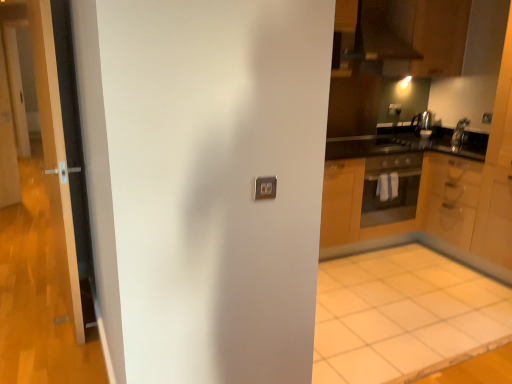
Question: Is wooden cabinet at right, which ranks as the first cabinetry in right-to-left order, at the right side of white tile floor at lower right?

Choices:
 (A) no
 (B) yes

Answer: (B)

Question: From a real-world perspective, is wooden cabinet at right, which ranks as the first cabinetry in right-to-left order, on white tile floor at lower right?

Choices:
 (A) yes
 (B) no

Answer: (A)

Question: Does wooden cabinet at right, placed as the second cabinetry when sorted from left to right, have a smaller size compared to white tile floor at lower right?

Choices:
 (A) no
 (B) yes

Answer: (A)

Question: From the image's perspective, is wooden cabinet at right, which ranks as the first cabinetry in right-to-left order, located beneath white tile floor at lower right?

Choices:
 (A) no
 (B) yes

Answer: (A)

Question: From the image's perspective, is wooden cabinet at right, which ranks as the first cabinetry in right-to-left order, located above white tile floor at lower right?

Choices:
 (A) no
 (B) yes

Answer: (B)

Question: From a real-world perspective, is satin silver kettle at upper right, which is counted as the second appliance, starting from the left, positioned above or below white tile floor at lower right?

Choices:
 (A) below
 (B) above

Answer: (B)

Question: From the image's perspective, relative to white tile floor at lower right, is satin silver kettle at upper right, the first appliance positioned from the right, above or below?

Choices:
 (A) below
 (B) above

Answer: (B)

Question: Is satin silver kettle at upper right, the first appliance positioned from the right, bigger or smaller than white tile floor at lower right?

Choices:
 (A) big
 (B) small

Answer: (B)

Question: Considering the positions of point (460, 140) and point (325, 294), is point (460, 140) closer or farther from the camera than point (325, 294)?

Choices:
 (A) closer
 (B) farther

Answer: (B)

Question: From a real-world perspective, relative to wooden cabinet at center, the second cabinetry viewed from the right, is clear glass screen door at left vertically above or below?

Choices:
 (A) below
 (B) above

Answer: (B)

Question: Is clear glass screen door at left inside the boundaries of wooden cabinet at center, which is the 1th cabinetry in left-to-right order, or outside?

Choices:
 (A) inside
 (B) outside

Answer: (B)

Question: Is point (15, 145) closer or farther from the camera than point (385, 228)?

Choices:
 (A) closer
 (B) farther

Answer: (B)

Question: In terms of width, does clear glass screen door at left look wider or thinner when compared to wooden cabinet at center, the second cabinetry viewed from the right?

Choices:
 (A) wide
 (B) thin

Answer: (B)

Question: Considering the positions of transparent glass door at left and clear glass screen door at left in the image, is transparent glass door at left bigger or smaller than clear glass screen door at left?

Choices:
 (A) big
 (B) small

Answer: (A)

Question: From the image's perspective, is transparent glass door at left located above or below clear glass screen door at left?

Choices:
 (A) above
 (B) below

Answer: (B)